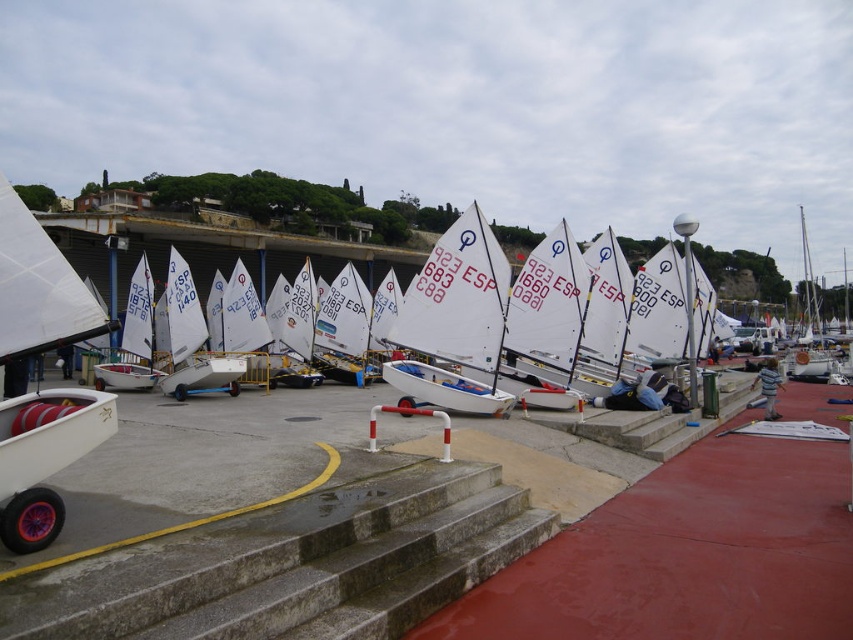
You are a participant in a sailing event and need to transport your white plastic sailboat at center to the water. The concrete steps at center are in your path. Can you carry the sailboat up the steps?

The concrete steps at center is larger in size than white plastic sailboat at center. Since the steps are larger, the sailboat should fit on them, but you should check the steps for any uneven surfaces before moving the boat.

You are a sailor preparing to launch your boat and need to access the water. You see the concrete steps at center and the white matte sailboat at center. Which object is directly above the other?

The white matte sailboat at center is directly above the concrete steps at center because the concrete steps at center is positioned under it.

You are a sailor preparing to launch your boat. You see the white plastic sailboat at center and the concrete steps at center. Which object is positioned lower in the scene?

The concrete steps at center are located below the white plastic sailboat at center, so the concrete steps at center is positioned lower in the scene.